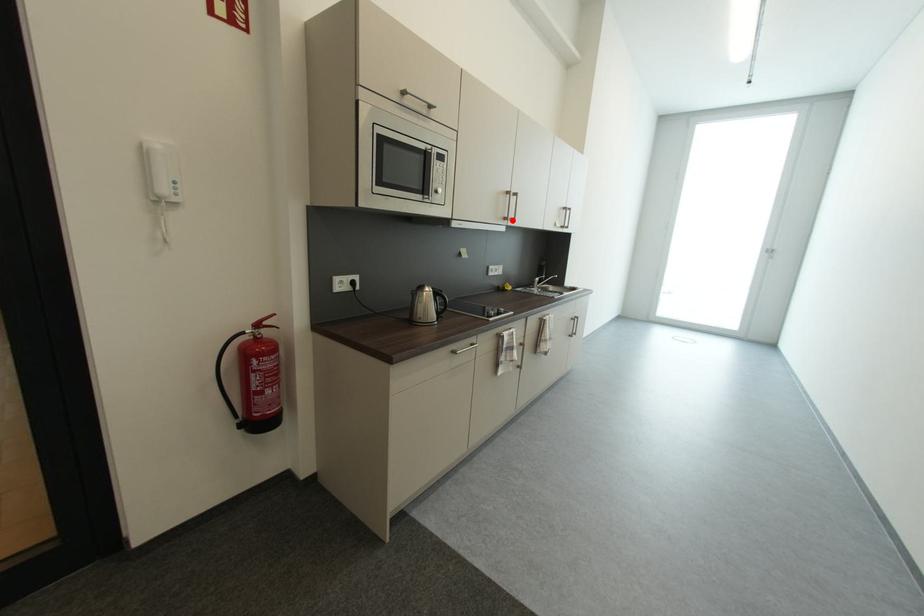
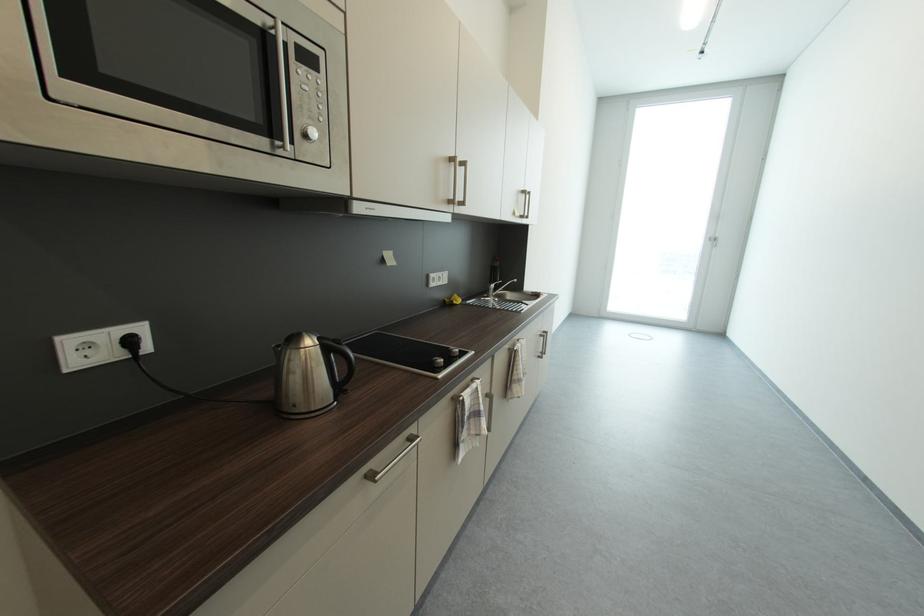
The point at the highlighted location is marked in the first image. Where is the corresponding point in the second image?

(457, 204)